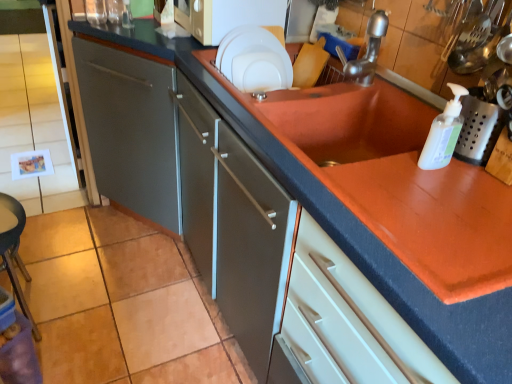
The image size is (512, 384). Find the location of `vacant area to the left of white plastic soap dispenser at upper right`. vacant area to the left of white plastic soap dispenser at upper right is located at coordinates (375, 173).